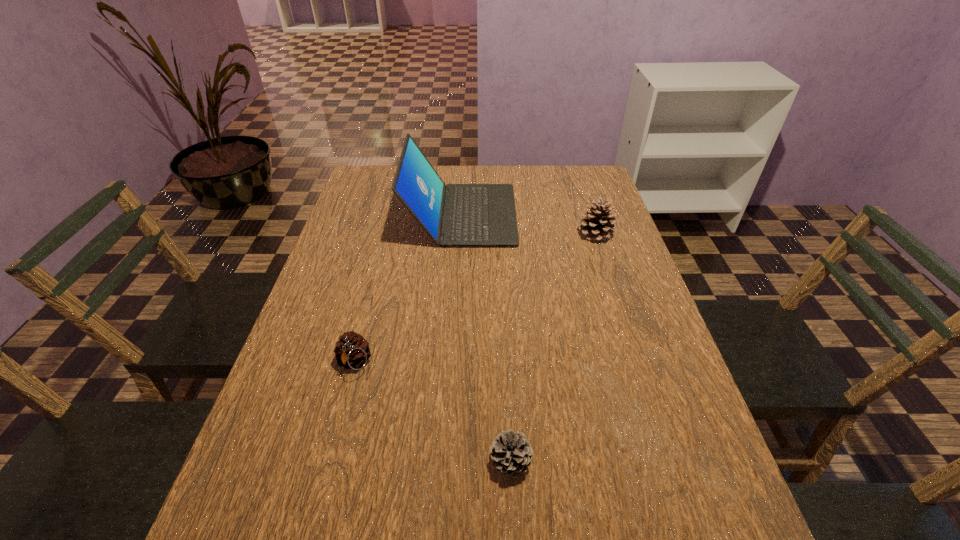
Locate an element on the screen. the tallest object is located at coordinates (454, 215).

Where is `the rightmost pinecone`? The height and width of the screenshot is (540, 960). the rightmost pinecone is located at coordinates (597, 224).

The height and width of the screenshot is (540, 960). Identify the location of the tallest pinecone. (597, 224).

Find the location of a particular element. The width and height of the screenshot is (960, 540). the second nearest object is located at coordinates (352, 350).

Identify the location of the leftmost pinecone. The width and height of the screenshot is (960, 540). [x=352, y=350].

At what (x,y) coordinates should I click in order to perform the action: click on the nearest object. Please return your answer as a coordinate pair (x, y). Image resolution: width=960 pixels, height=540 pixels. Looking at the image, I should click on pyautogui.click(x=511, y=453).

Where is `the nearest pinecone`? The image size is (960, 540). the nearest pinecone is located at coordinates (511, 453).

Where is `free space located on the screen of the tallest object`? The image size is (960, 540). free space located on the screen of the tallest object is located at coordinates (556, 215).

I want to click on vacant space located on the back of the farthest pinecone, so click(578, 182).

Identify the location of vacant space located with a leaf charm attached to the leftmost pinecone. The image size is (960, 540). (323, 483).